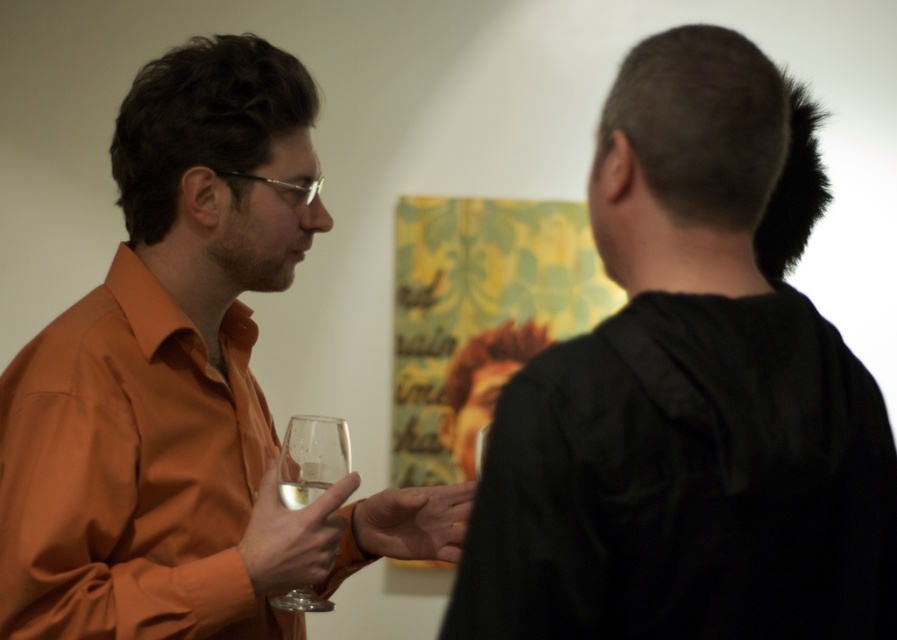
You are at a party and want to take a photo of the orange matte shirt at left and the clear glass wine glass at center. Which object should you zoom in on to ensure both are in focus?

The orange matte shirt at left is larger in size than the clear glass wine glass at center, so you should zoom in on the orange matte shirt at left to ensure both are in focus.

You are a photographer trying to capture a closeup of the black matte shirt at upper right and the clear glass wine glass at center. Which object should you zoom in on to ensure both fit in the frame without cropping?

The clear glass wine glass at center has a smaller width than the black matte shirt at upper right, so you should zoom in on the black matte shirt at upper right to ensure both fit in the frame without cropping.